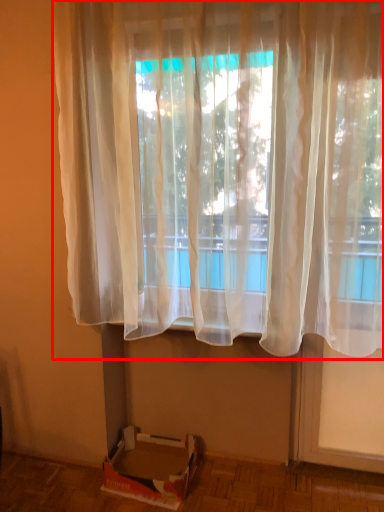
Question: From the image's perspective, where is curtain (annotated by the red box) located relative to cardboard box?

Choices:
 (A) below
 (B) above

Answer: (B)